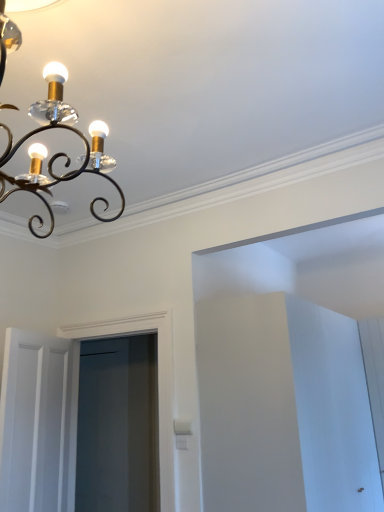
Question: Can you see clear glass screen door at center touching white wooden door at lower left?

Choices:
 (A) yes
 (B) no

Answer: (B)

Question: From a real-world perspective, is clear glass screen door at center located higher than white wooden door at lower left?

Choices:
 (A) yes
 (B) no

Answer: (A)

Question: Can you confirm if clear glass screen door at center is wider than white wooden door at lower left?

Choices:
 (A) yes
 (B) no

Answer: (A)

Question: Is clear glass screen door at center looking in the opposite direction of white wooden door at lower left?

Choices:
 (A) no
 (B) yes

Answer: (B)

Question: From a real-world perspective, is clear glass screen door at center located beneath white wooden door at lower left?

Choices:
 (A) yes
 (B) no

Answer: (B)

Question: Would you say matte black chandelier at upper left is to the left or to the right of clear glass screen door at center in the picture?

Choices:
 (A) right
 (B) left

Answer: (A)

Question: Relative to clear glass screen door at center, is matte black chandelier at upper left in front or behind?

Choices:
 (A) behind
 (B) front

Answer: (B)

Question: In terms of height, does matte black chandelier at upper left look taller or shorter compared to clear glass screen door at center?

Choices:
 (A) short
 (B) tall

Answer: (A)

Question: Considering the positions of matte black chandelier at upper left and clear glass screen door at center in the image, is matte black chandelier at upper left wider or thinner than clear glass screen door at center?

Choices:
 (A) wide
 (B) thin

Answer: (A)

Question: In terms of height, does white wooden door at lower left look taller or shorter compared to matte black chandelier at upper left?

Choices:
 (A) short
 (B) tall

Answer: (B)

Question: Would you say white wooden door at lower left is inside or outside matte black chandelier at upper left?

Choices:
 (A) outside
 (B) inside

Answer: (A)

Question: In the image, is white wooden door at lower left on the left side or the right side of matte black chandelier at upper left?

Choices:
 (A) right
 (B) left

Answer: (B)

Question: Relative to matte black chandelier at upper left, is white wooden door at lower left in front or behind?

Choices:
 (A) behind
 (B) front

Answer: (A)

Question: In the image, is white wooden door at lower left positioned in front of or behind clear glass screen door at center?

Choices:
 (A) behind
 (B) front

Answer: (B)

Question: From a real-world perspective, is white wooden door at lower left physically located above or below clear glass screen door at center?

Choices:
 (A) above
 (B) below

Answer: (B)